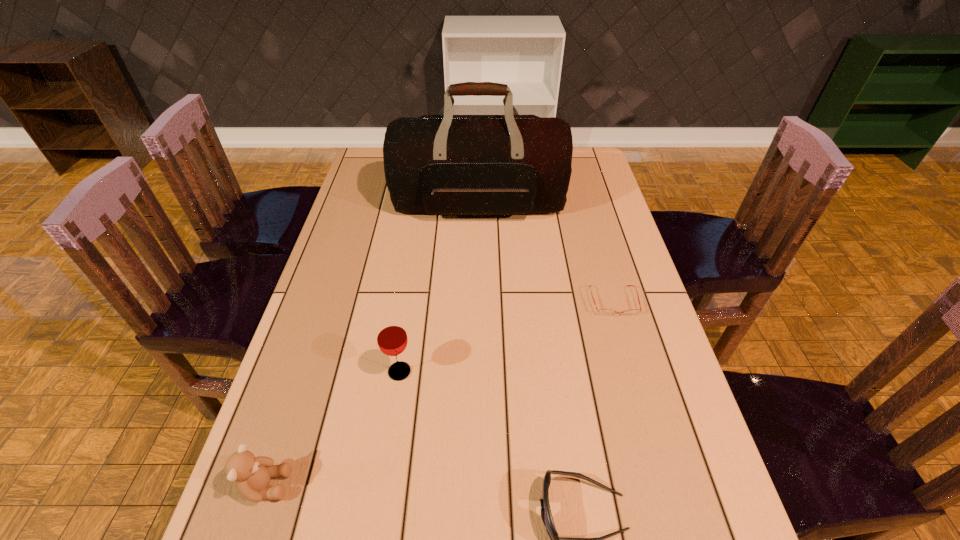
This screenshot has height=540, width=960. Identify the location of the tallest object. (445, 164).

Identify the location of the farthest object. (445, 164).

The width and height of the screenshot is (960, 540). Identify the location of glass. (392, 340).

Identify the location of the second tallest object. (392, 340).

This screenshot has width=960, height=540. I want to click on the leftmost object, so click(x=252, y=474).

Where is `teddy bear`? teddy bear is located at coordinates (252, 474).

Identify the location of the shortest object. Image resolution: width=960 pixels, height=540 pixels. (x=605, y=312).

You are a GUI agent. You are given a task and a screenshot of the screen. Output one action in this format:
    pyautogui.click(x=<x>, y=<y>)
    Task: Click on the spectacles
    Image resolution: width=960 pixels, height=540 pixels.
    Given the screenshot: What is the action you would take?
    pyautogui.click(x=605, y=312)

The image size is (960, 540). What are the coordinates of `free space located on the front pocket of the farthest object` in the screenshot? It's located at (479, 260).

At what (x,y) coordinates should I click in order to perform the action: click on vacant space situated 0.120m on the right of the second tallest object. Please return your answer as a coordinate pair (x, y). The image size is (960, 540). Looking at the image, I should click on (465, 372).